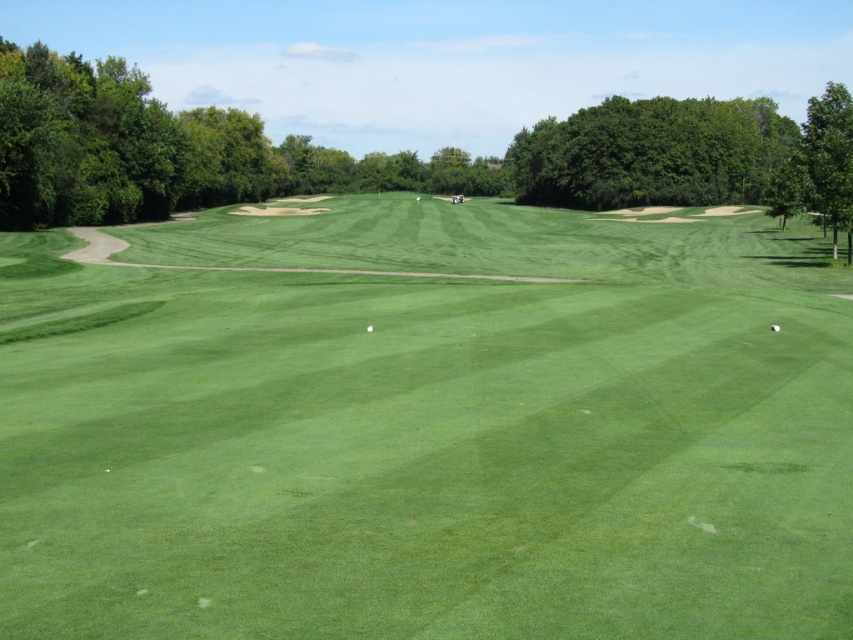
Which is more to the right, green leafy tree at right or green smooth golf ball at center?

green leafy tree at right is more to the right.

At what (x,y) coordinates should I click in order to perform the action: click on green leafy tree at right. Please return your answer as a coordinate pair (x, y). Looking at the image, I should click on (819, 168).

What do you see at coordinates (819, 168) in the screenshot?
I see `green leafy tree at right` at bounding box center [819, 168].

You are a GUI agent. You are given a task and a screenshot of the screen. Output one action in this format:
    pyautogui.click(x=<x>, y=<y>)
    Task: Click on the green leafy tree at right
    This screenshot has height=640, width=853.
    Given the screenshot: What is the action you would take?
    pyautogui.click(x=819, y=168)

Can you confirm if green leafy tree at upper right is taller than green smooth golf ball at center?

Indeed, green leafy tree at upper right has a greater height compared to green smooth golf ball at center.

Is green leafy tree at upper right closer to camera compared to green smooth golf ball at center?

No.

The width and height of the screenshot is (853, 640). What do you see at coordinates (651, 154) in the screenshot?
I see `green leafy tree at upper right` at bounding box center [651, 154].

Identify the location of green leafy tree at upper right. (651, 154).

Is green grassy field at center smaller than green smooth golf ball at lower right?

Actually, green grassy field at center might be larger than green smooth golf ball at lower right.

At what (x,y) coordinates should I click in order to perform the action: click on green grassy field at center. Please return your answer as a coordinate pair (x, y). Looking at the image, I should click on (427, 428).

Locate an element on the screen. Image resolution: width=853 pixels, height=640 pixels. green grassy field at center is located at coordinates (427, 428).